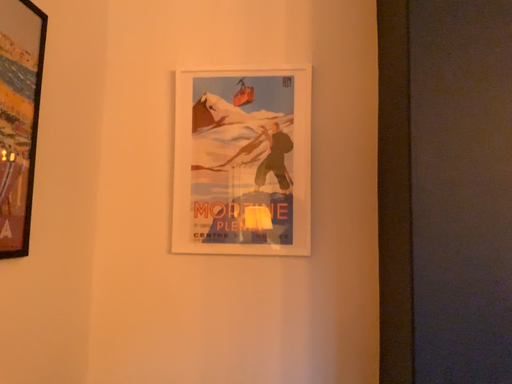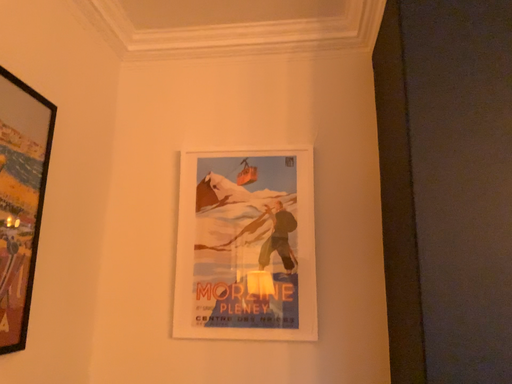
Question: Which way did the camera rotate in the video?

Choices:
 (A) rotated upward
 (B) rotated downward

Answer: (A)